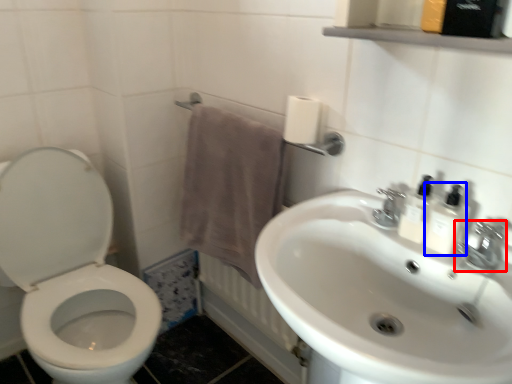
Question: Among these objects, which one is farthest to the camera, tap (highlighted by a red box) or mouthwash (highlighted by a blue box)?

Choices:
 (A) tap
 (B) mouthwash

Answer: (B)